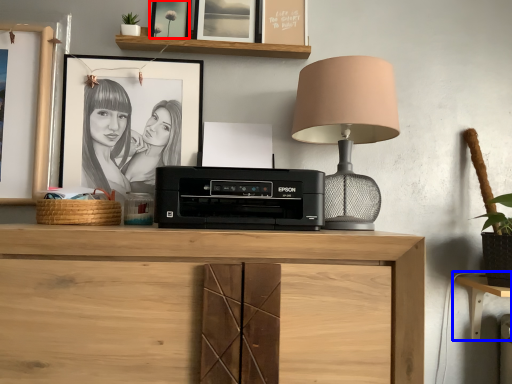
Question: Which object is further to the camera taking this photo, picture frame (highlighted by a red box) or computer desk (highlighted by a blue box)?

Choices:
 (A) picture frame
 (B) computer desk

Answer: (A)